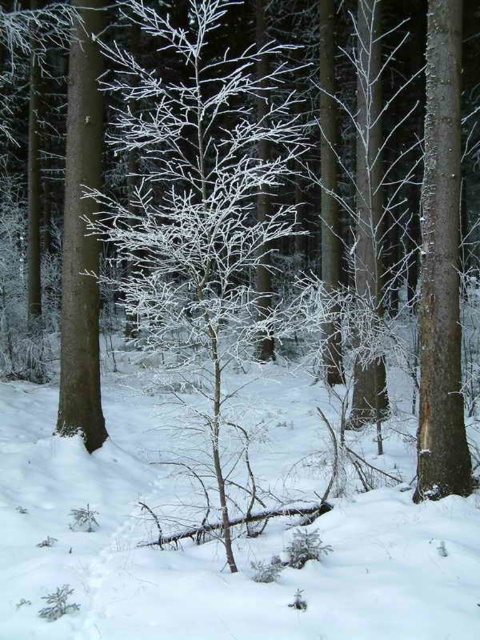
Does white frosty snow at center appear over frosted white tree at center?

No, white frosty snow at center is not above frosted white tree at center.

Can you confirm if white frosty snow at center is smaller than frosted white tree at center?

Indeed, white frosty snow at center has a smaller size compared to frosted white tree at center.

Between point (387, 461) and point (146, 19), which one is positioned in front?

Point (146, 19) is in front.

Where is `white frosty snow at center`? The image size is (480, 640). white frosty snow at center is located at coordinates (215, 544).